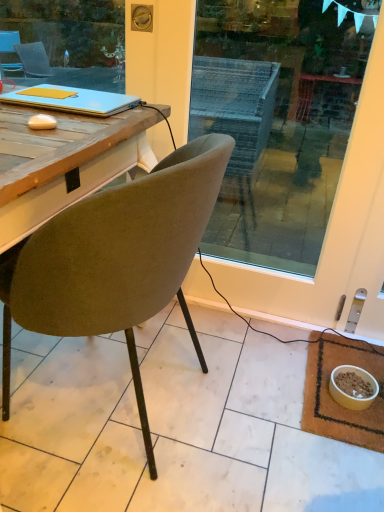
Identify the location of vacant region above matte blue laptop at upper left (from a real-world perspective). (52, 91).